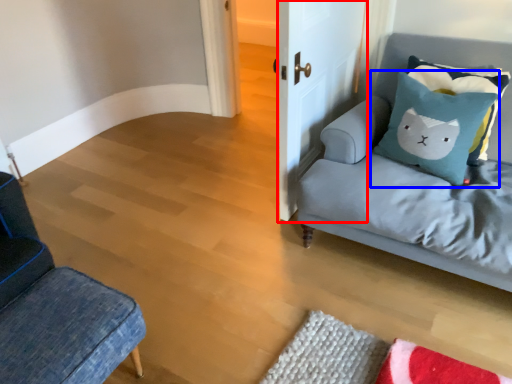
Question: Which object appears closest to the camera in this image, door (highlighted by a red box) or pillow (highlighted by a blue box)?

Choices:
 (A) door
 (B) pillow

Answer: (A)